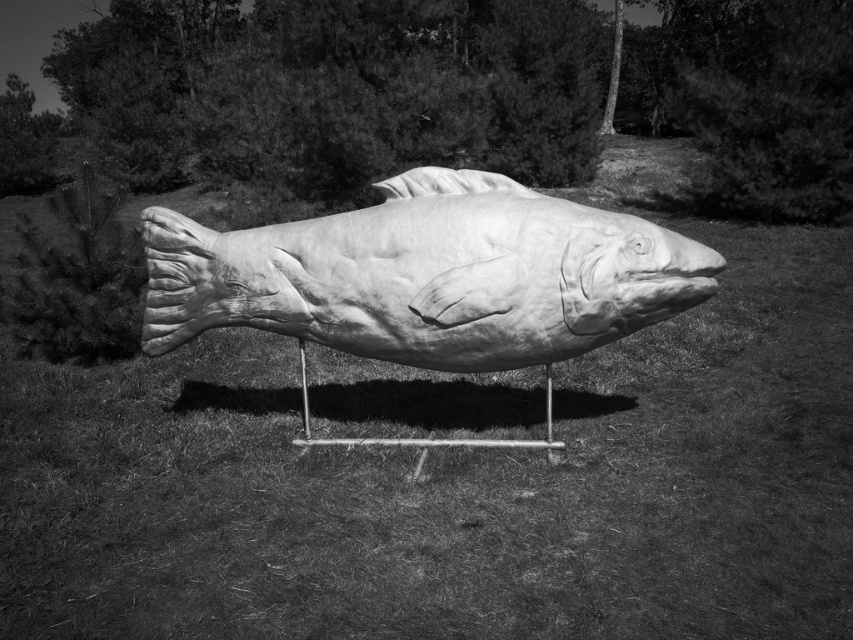
Question: Among these points, which one is farthest from the camera?

Choices:
 (A) (514, 268)
 (B) (131, 480)

Answer: (B)

Question: Does smooth grass at center have a larger size compared to smooth wood fish at center?

Choices:
 (A) no
 (B) yes

Answer: (A)

Question: Does smooth grass at center appear on the left side of smooth wood fish at center?

Choices:
 (A) yes
 (B) no

Answer: (B)

Question: Among these points, which one is farthest from the camera?

Choices:
 (A) (332, 285)
 (B) (537, 371)

Answer: (B)

Question: Can you confirm if smooth grass at center is positioned below smooth wood fish at center?

Choices:
 (A) yes
 (B) no

Answer: (A)